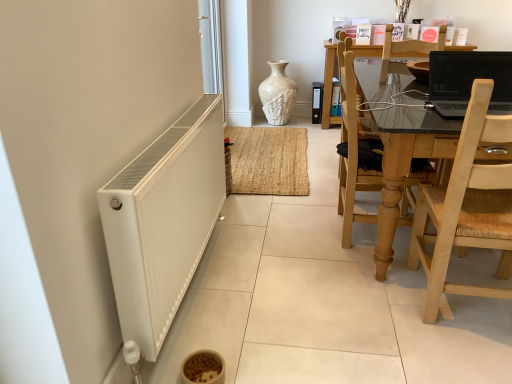
Locate an element on the screen. This screenshot has width=512, height=384. free space underneath light wood woven seat at right, the second chair in the back-to-front sequence (from a real-world perspective) is located at coordinates (476, 316).